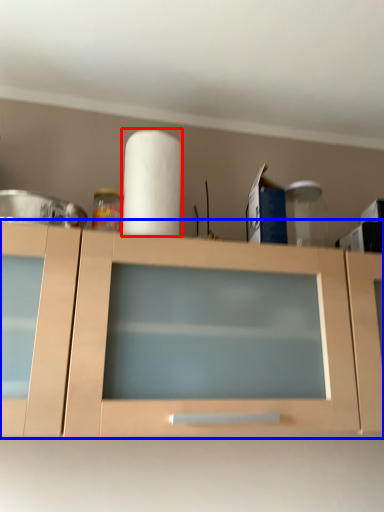
Question: Which of the following is the closest to the observer, paper towel (highlighted by a red box) or cabinetry (highlighted by a blue box)?

Choices:
 (A) paper towel
 (B) cabinetry

Answer: (B)